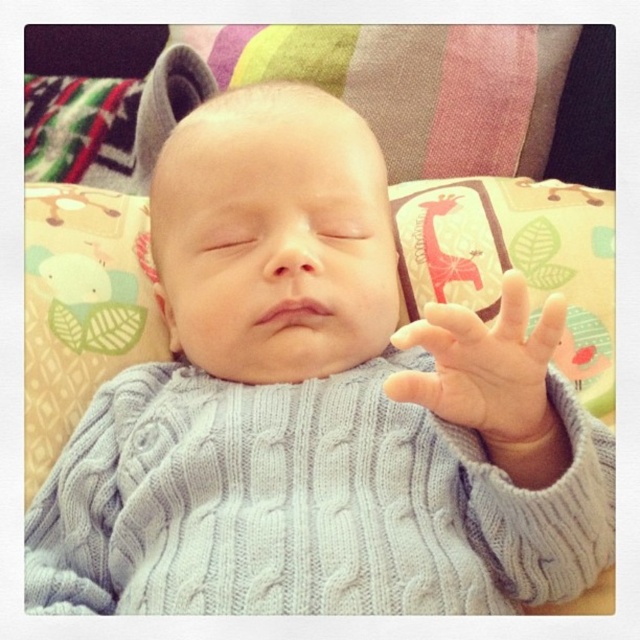
Question: Is cable-knit sweater at center above white knitted hand at center?

Choices:
 (A) no
 (B) yes

Answer: (B)

Question: Among these objects, which one is farthest from the camera?

Choices:
 (A) white knitted hand at center
 (B) cable-knit sweater at center

Answer: (B)

Question: Which point is closer to the camera?

Choices:
 (A) (548, 339)
 (B) (269, 228)

Answer: (A)

Question: Can you confirm if cable-knit sweater at center is positioned above white knitted hand at center?

Choices:
 (A) no
 (B) yes

Answer: (B)

Question: Is cable-knit sweater at center smaller than white knitted hand at center?

Choices:
 (A) yes
 (B) no

Answer: (B)